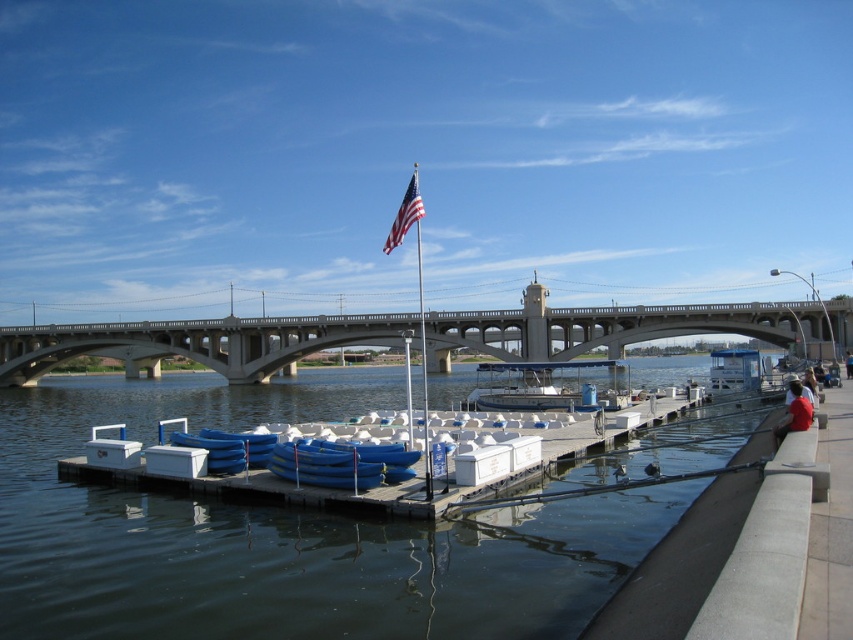
Question: Which point appears closest to the camera in this image?

Choices:
 (A) (648, 458)
 (B) (410, 173)

Answer: (A)

Question: Which object is farther from the camera taking this photo?

Choices:
 (A) american flag at upper center
 (B) white plastic dock at center
 (C) blue fabric jacket at lower right

Answer: (C)

Question: Is clear water at dock center to the left of concrete bridge at center from the viewer's perspective?

Choices:
 (A) yes
 (B) no

Answer: (B)

Question: Is red fabric shirt at lower right below blue fabric jacket at lower right?

Choices:
 (A) yes
 (B) no

Answer: (A)

Question: Is concrete bridge at center below american flag at upper center?

Choices:
 (A) yes
 (B) no

Answer: (A)

Question: Which of the following is the farthest from the observer?

Choices:
 (A) (28, 496)
 (B) (848, 362)
 (C) (397, 243)
 (D) (54, 364)

Answer: (D)